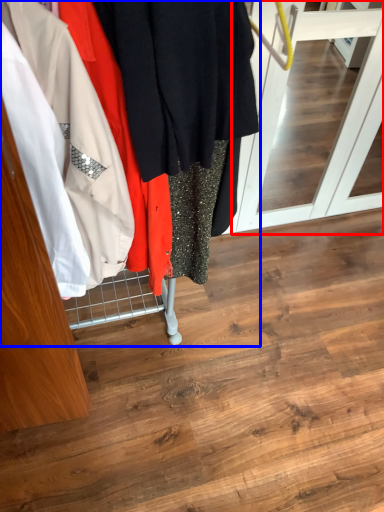
Question: Which point is further to the camera, screen door (highlighted by a red box) or closet (highlighted by a blue box)?

Choices:
 (A) screen door
 (B) closet

Answer: (A)